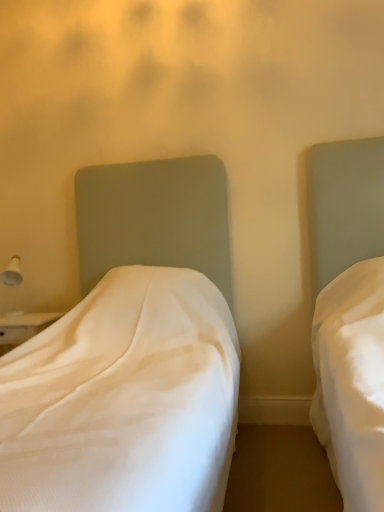
Question: Can you confirm if white fabric bed at left, which appears as the second bed when viewed from the right, is bigger than white glossy lampshade at left?

Choices:
 (A) no
 (B) yes

Answer: (B)

Question: Is white fabric bed at left, the 1th bed positioned from the left, turned away from white glossy lampshade at left?

Choices:
 (A) yes
 (B) no

Answer: (B)

Question: From a real-world perspective, is white fabric bed at left, the 1th bed positioned from the left, under white glossy lampshade at left?

Choices:
 (A) no
 (B) yes

Answer: (B)

Question: Can you confirm if white fabric bed at left, which appears as the second bed when viewed from the right, is taller than white glossy lampshade at left?

Choices:
 (A) no
 (B) yes

Answer: (B)

Question: Is white fabric bed at left, which appears as the second bed when viewed from the right, positioned before white glossy lampshade at left?

Choices:
 (A) no
 (B) yes

Answer: (B)

Question: Can you confirm if white glossy lampshade at left is shorter than white fabric bed at left, which appears as the second bed when viewed from the right?

Choices:
 (A) no
 (B) yes

Answer: (B)

Question: Is white glossy lampshade at left further to camera compared to white fabric bed at left, which appears as the second bed when viewed from the right?

Choices:
 (A) yes
 (B) no

Answer: (A)

Question: Is white glossy lampshade at left turned away from white fabric bed at left, which appears as the second bed when viewed from the right?

Choices:
 (A) yes
 (B) no

Answer: (B)

Question: Does white glossy lampshade at left touch white fabric bed at left, which appears as the second bed when viewed from the right?

Choices:
 (A) yes
 (B) no

Answer: (B)

Question: From the image's perspective, is white glossy lampshade at left on top of white fabric bed at left, the 1th bed positioned from the left?

Choices:
 (A) yes
 (B) no

Answer: (A)

Question: Can you confirm if white glossy lampshade at left is positioned to the left of white fabric bed at left, which appears as the second bed when viewed from the right?

Choices:
 (A) no
 (B) yes

Answer: (B)

Question: Can you confirm if matte white bed at right, acting as the first bed starting from the right, is positioned to the right of white glossy lampshade at left?

Choices:
 (A) no
 (B) yes

Answer: (B)